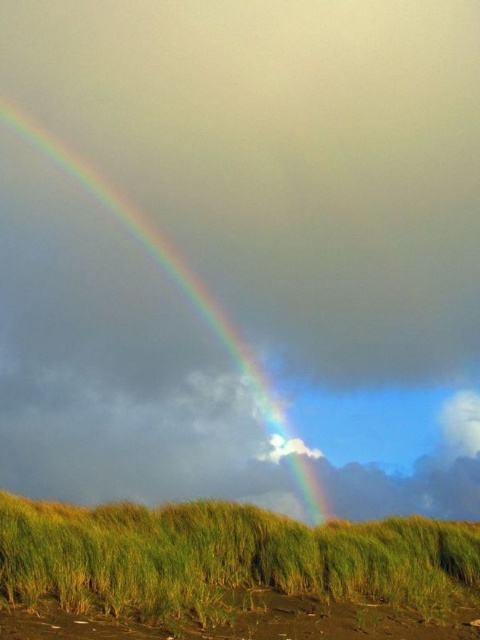
Question: Can you confirm if green grassy at lower center is positioned to the right of rainbow at upper left?

Choices:
 (A) yes
 (B) no

Answer: (A)

Question: Which of these objects is positioned farthest from the rainbow at upper left?

Choices:
 (A) brown sandy beach at lower center
 (B) green grassy at lower center

Answer: (A)

Question: Can you confirm if green grassy at lower center is wider than rainbow at upper left?

Choices:
 (A) no
 (B) yes

Answer: (A)

Question: Is brown sandy beach at lower center to the right of rainbow at upper left from the viewer's perspective?

Choices:
 (A) yes
 (B) no

Answer: (A)

Question: Which point is farther from the camera taking this photo?

Choices:
 (A) (96, 586)
 (B) (360, 630)
 (C) (205, 310)

Answer: (C)

Question: Which point appears farthest from the camera in this image?

Choices:
 (A) (432, 588)
 (B) (290, 609)

Answer: (A)